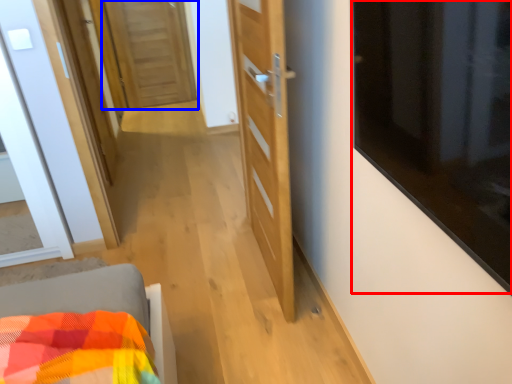
Question: Which of the following is the closest to the observer, window (highlighted by a red box) or door (highlighted by a blue box)?

Choices:
 (A) window
 (B) door

Answer: (A)